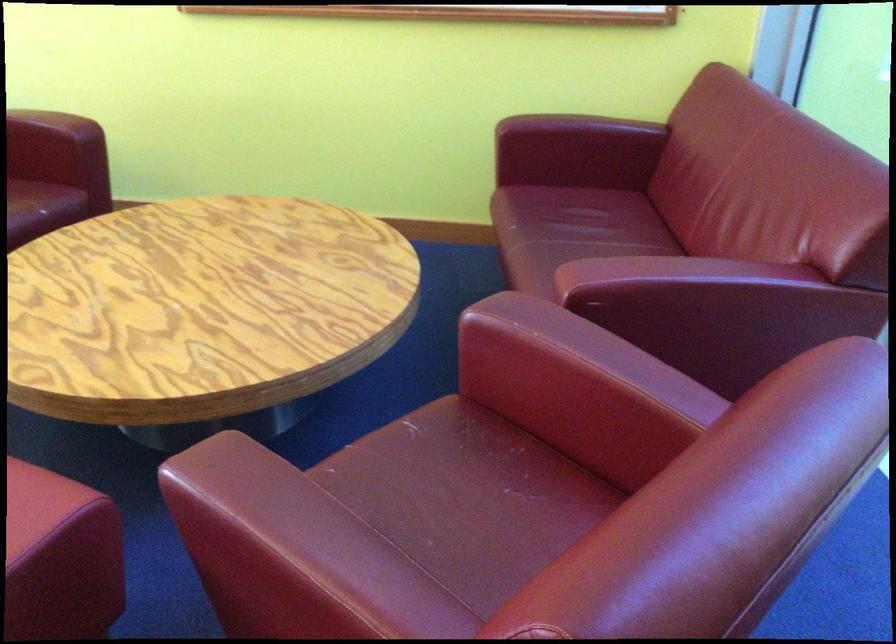
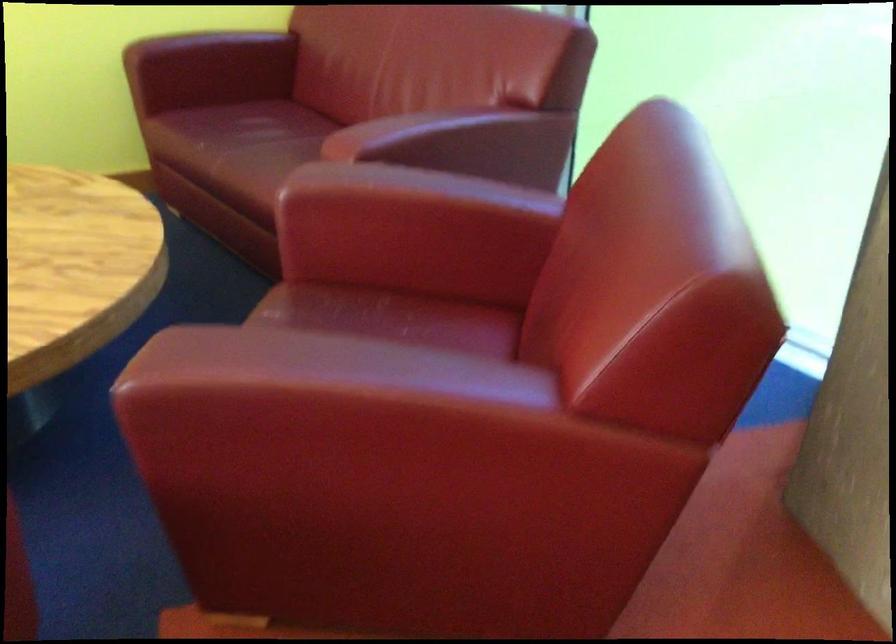
Question: The camera is either moving clockwise (left) or counter-clockwise (right) around the object. The first image is from the beginning of the video and the second image is from the end. Is the camera moving left or right when shooting the video?

Choices:
 (A) Left
 (B) Right

Answer: (A)